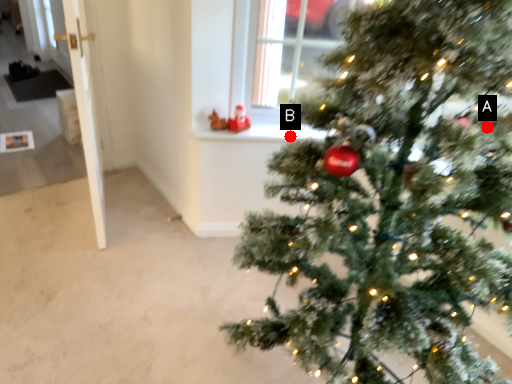
Question: Two points are circled on the image, labeled by A and B beside each circle. Which of the following is the closest to the observer?

Choices:
 (A) A is closer
 (B) B is closer

Answer: (A)